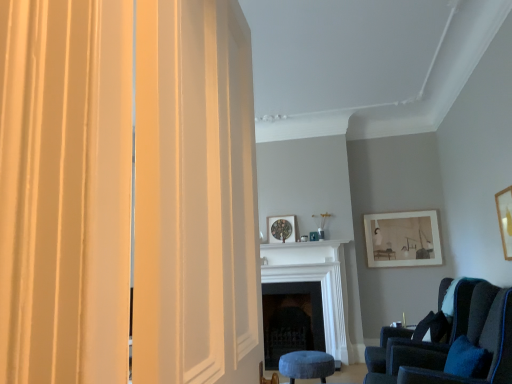
Question: Can you confirm if dark wood fireplace at center, the first fireplace viewed from the back, is wider than matte wooden picture frame at upper right, which ranks as the second picture frame in right-to-left order?

Choices:
 (A) yes
 (B) no

Answer: (A)

Question: Is dark wood fireplace at center, marked as the second fireplace in a front-to-back arrangement, facing away from matte wooden picture frame at upper right, arranged as the second picture frame when viewed from the front?

Choices:
 (A) yes
 (B) no

Answer: (B)

Question: Is dark wood fireplace at center, the first fireplace viewed from the back, oriented towards matte wooden picture frame at upper right, arranged as the second picture frame when viewed from the front?

Choices:
 (A) yes
 (B) no

Answer: (B)

Question: Is matte wooden picture frame at upper right, the 2th picture frame viewed from the back, inside dark wood fireplace at center, marked as the second fireplace in a front-to-back arrangement?

Choices:
 (A) yes
 (B) no

Answer: (B)

Question: Is dark wood fireplace at center, marked as the second fireplace in a front-to-back arrangement, positioned before matte wooden picture frame at upper right, the second picture frame in the left-to-right sequence?

Choices:
 (A) yes
 (B) no

Answer: (A)

Question: Relative to velvet dark blue chair at lower right, is matte wooden picture frame at upper right, which ranks as the second picture frame in right-to-left order, in front or behind?

Choices:
 (A) front
 (B) behind

Answer: (B)

Question: Is point (389, 231) closer or farther from the camera than point (506, 377)?

Choices:
 (A) farther
 (B) closer

Answer: (A)

Question: From the image's perspective, is matte wooden picture frame at upper right, arranged as the second picture frame when viewed from the front, positioned above or below velvet dark blue chair at lower right?

Choices:
 (A) above
 (B) below

Answer: (A)

Question: From their relative heights in the image, would you say matte wooden picture frame at upper right, the second picture frame in the left-to-right sequence, is taller or shorter than velvet dark blue chair at lower right?

Choices:
 (A) tall
 (B) short

Answer: (A)

Question: Is matte wooden picture frame at upper right, the second picture frame in the left-to-right sequence, wider or thinner than matte cream curtain at left?

Choices:
 (A) thin
 (B) wide

Answer: (A)

Question: Do you think matte wooden picture frame at upper right, the 2th picture frame viewed from the back, is within matte cream curtain at left, or outside of it?

Choices:
 (A) inside
 (B) outside

Answer: (B)

Question: From the image's perspective, is matte wooden picture frame at upper right, which ranks as the second picture frame in right-to-left order, above or below matte cream curtain at left?

Choices:
 (A) below
 (B) above

Answer: (A)

Question: Based on their positions, is matte wooden picture frame at upper right, arranged as the second picture frame when viewed from the front, located to the left or right of matte cream curtain at left?

Choices:
 (A) right
 (B) left

Answer: (A)

Question: From their relative heights in the image, would you say dark wood fireplace at center, the first fireplace viewed from the back, is taller or shorter than matte wooden picture frame at center, which is the 3th picture frame from front to back?

Choices:
 (A) short
 (B) tall

Answer: (B)

Question: Is dark wood fireplace at center, the first fireplace viewed from the back, in front of or behind matte wooden picture frame at center, placed as the first picture frame when sorted from back to front, in the image?

Choices:
 (A) behind
 (B) front

Answer: (B)